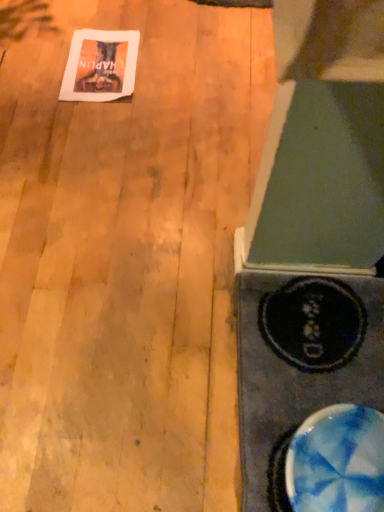
Question: Which is correct: white paper at upper left is inside blue marbled bowl at lower right, or outside of it?

Choices:
 (A) inside
 (B) outside

Answer: (B)

Question: Is white paper at upper left taller or shorter than blue marbled bowl at lower right?

Choices:
 (A) tall
 (B) short

Answer: (B)

Question: Estimate the real-world distances between objects in this image. Which object is closer to the wooden floor at upper left?

Choices:
 (A) white paper at upper left
 (B) blue marbled bowl at lower right

Answer: (A)

Question: Based on their relative distances, which object is farther from the white paper at upper left?

Choices:
 (A) blue marbled bowl at lower right
 (B) wooden floor at upper left

Answer: (A)